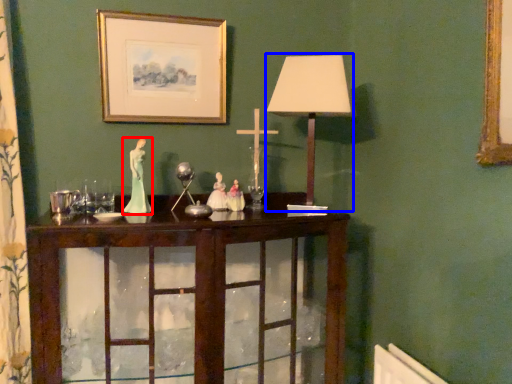
Question: Among these objects, which one is farthest to the camera, miniature (highlighted by a red box) or table lamp (highlighted by a blue box)?

Choices:
 (A) miniature
 (B) table lamp

Answer: (A)